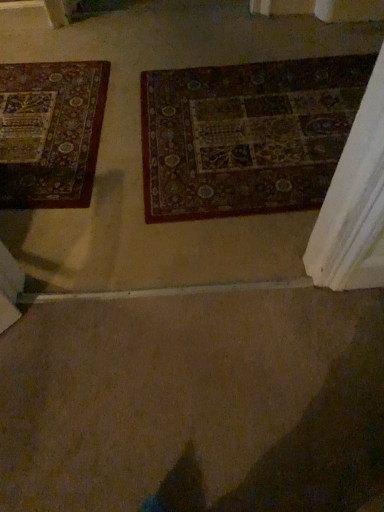
Describe the element at coordinates (246, 135) in the screenshot. This screenshot has width=384, height=512. I see `dark brown woven mat at center` at that location.

Locate an element on the screen. dark brown woven mat at center is located at coordinates (246, 135).

The width and height of the screenshot is (384, 512). I want to click on dark brown woven mat at center, so click(x=246, y=135).